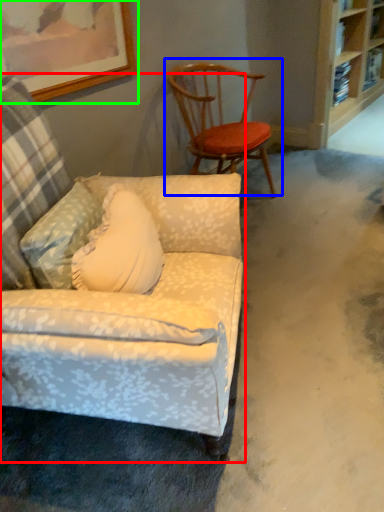
Question: Estimate the real-world distances between objects in this image. Which object is closer to chair (highlighted by a red box), chair (highlighted by a blue box) or picture frame (highlighted by a green box)?

Choices:
 (A) chair
 (B) picture frame

Answer: (B)